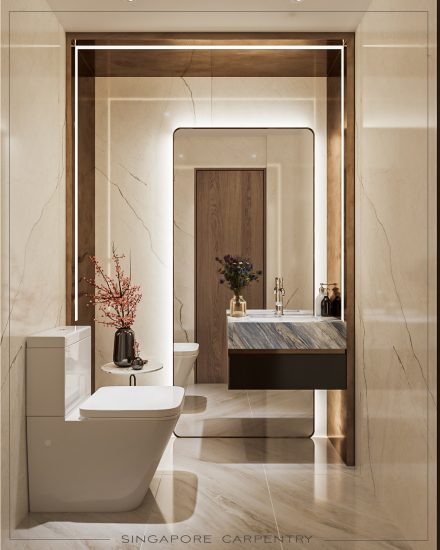
Where is `reflection of bathroom door`? This screenshot has height=550, width=440. reflection of bathroom door is located at coordinates (239, 231).